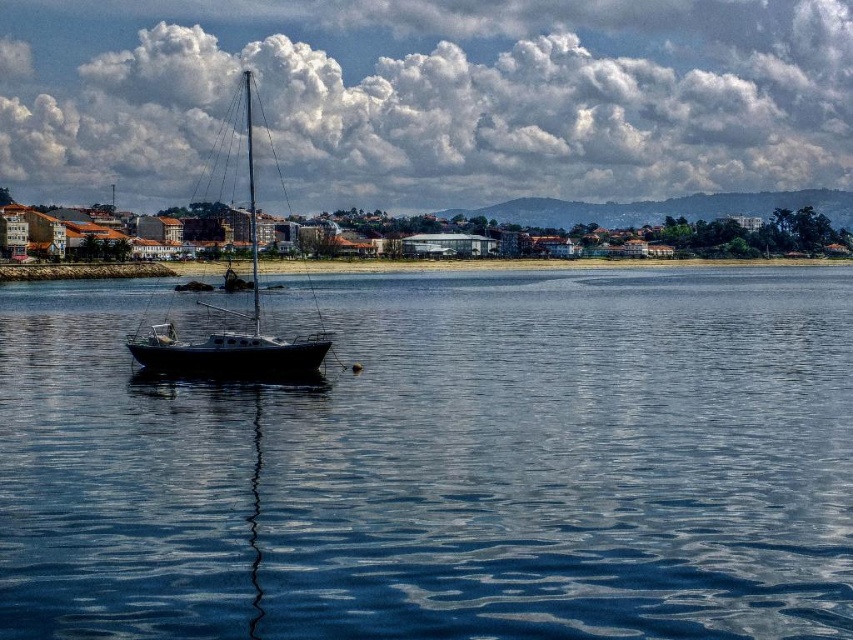
You are standing at the point with coordinates point (149, 353) and want to walk to the point with coordinates point (590, 449). Which direction should you face to walk towards your destination?

You should face towards the point (590, 449) because it is in front of point (149, 353).

You are standing on the beach and looking at the white fluffy cloud at upper center. If you want to estimate how far the cloud is from you, what would you say?

The white fluffy cloud at upper center is 333.00 meters away from the viewer.

You are an artist painting the coastal scene. You want to ensure the white fluffy cloud at upper center and the shiny black sailboat at center are proportionally accurate. Which object should you draw larger?

The white fluffy cloud at upper center should be drawn larger since it is bigger than the shiny black sailboat at center according to the description.